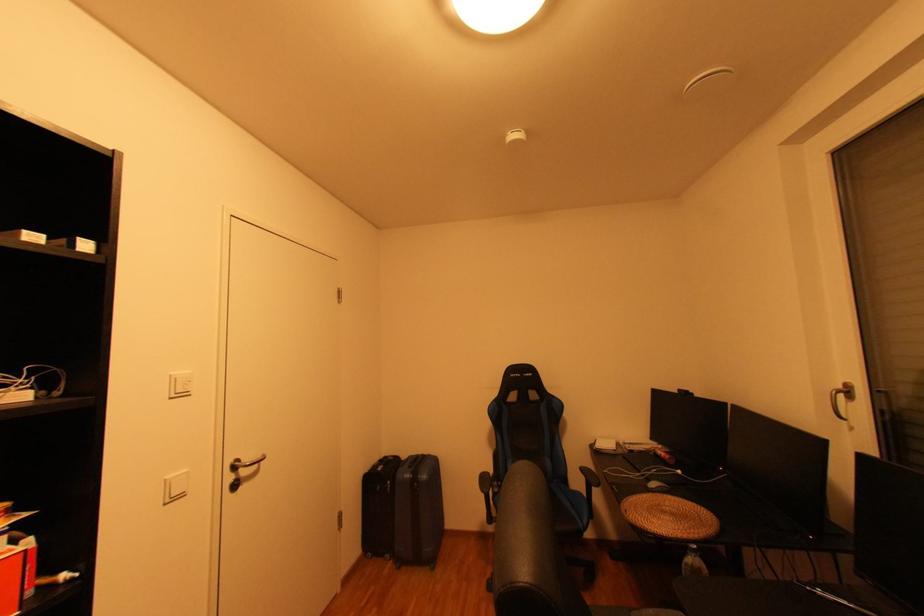
Where would you lift the woven placemat? Please return your answer as a coordinate pair (x, y).

(670, 517)